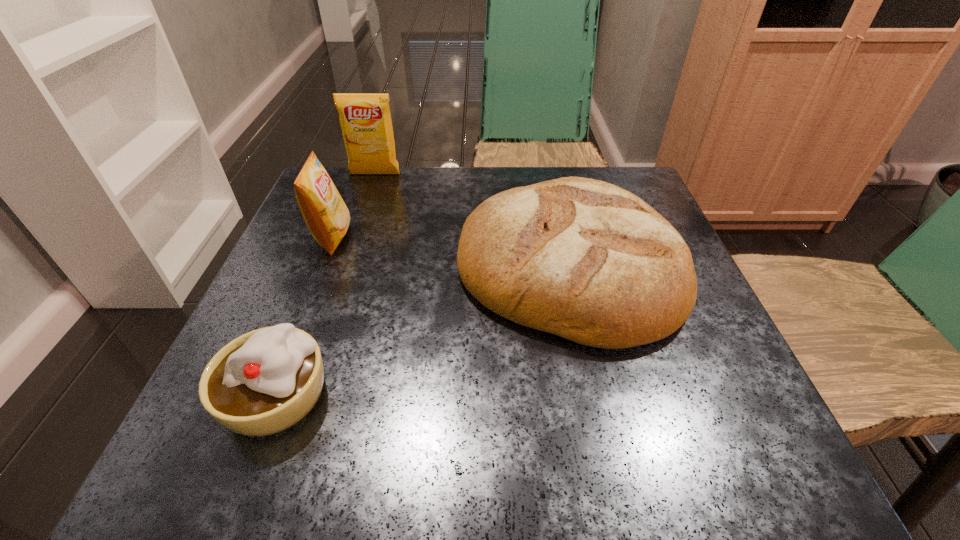
The height and width of the screenshot is (540, 960). Find the location of `the farther crisp (potato chip)`. the farther crisp (potato chip) is located at coordinates (365, 119).

The image size is (960, 540). I want to click on the farthest object, so click(365, 119).

Identify the location of the third shortest object. (326, 215).

Identify the location of the shorter crisp (potato chip). The height and width of the screenshot is (540, 960). (326, 215).

The image size is (960, 540). I want to click on bread, so click(586, 260).

Identify the location of whipped cream. (263, 382).

The image size is (960, 540). I want to click on free location located on the front of the tallest object with the logo, so click(x=350, y=247).

Identify the location of vacant space located 0.150m on the front-facing side of the shorter crisp (potato chip). point(424,238).

Image resolution: width=960 pixels, height=540 pixels. Find the location of `free space located on the left of the bread`. free space located on the left of the bread is located at coordinates (298, 266).

Find the location of `blank space located 0.320m on the back of the whipped cream`. blank space located 0.320m on the back of the whipped cream is located at coordinates (340, 228).